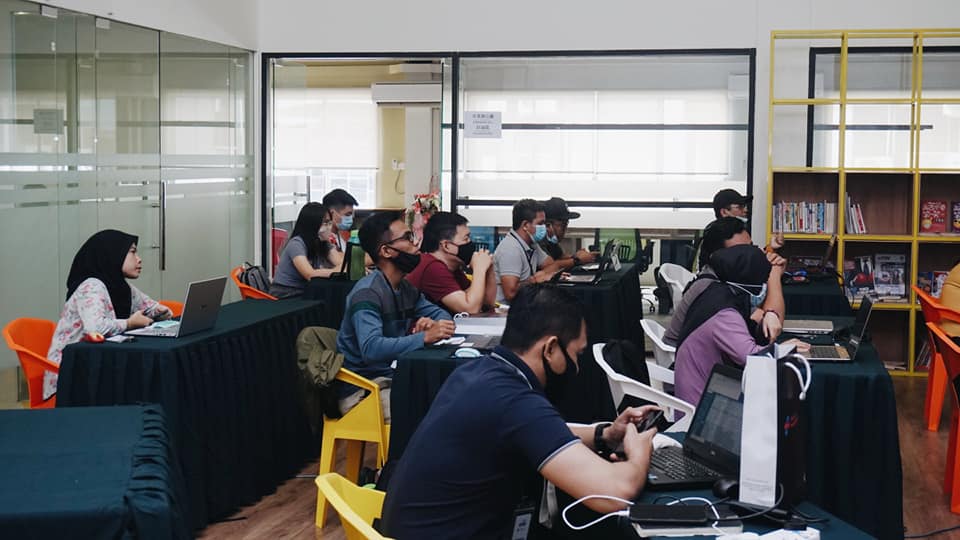
You are a GUI agent. You are given a task and a screenshot of the screen. Output one action in this format:
    pyautogui.click(x=<x>, y=<y>)
    Task: Click on the window
    This screenshot has height=540, width=960.
    Given the screenshot: What is the action you would take?
    pyautogui.click(x=645, y=145), pyautogui.click(x=955, y=123)